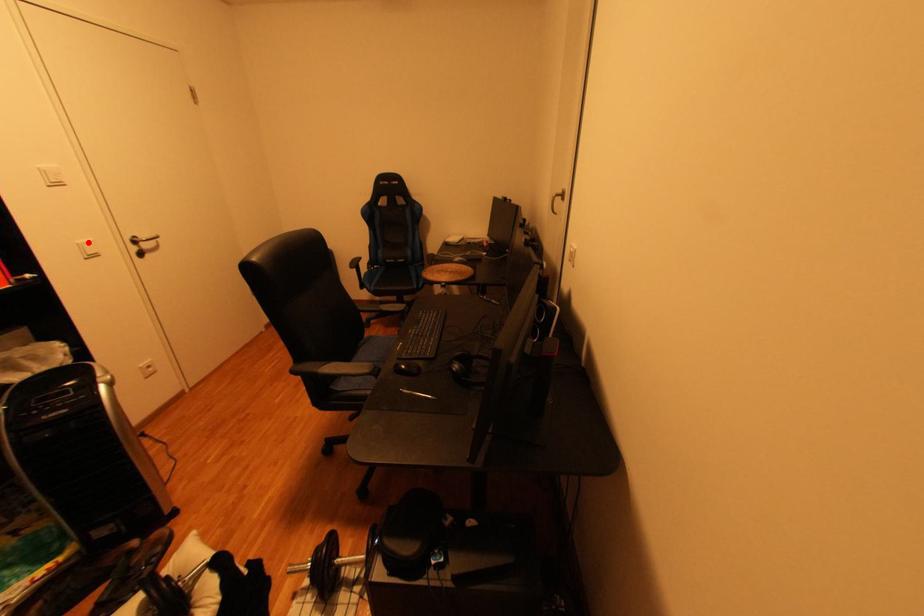
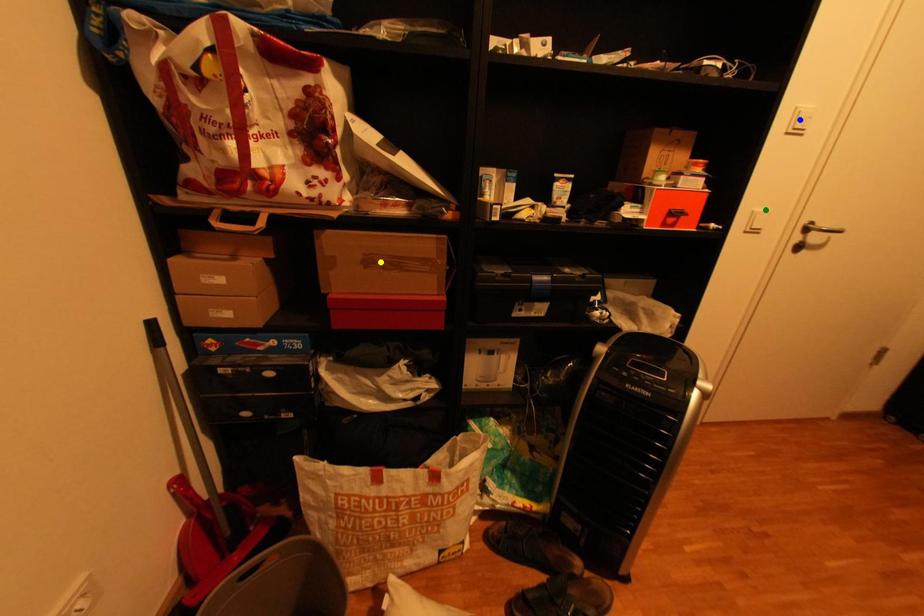
Question: I am providing you with two images of the same scene from different viewpoints. A red point is marked on the first image. You are given multiple points on the second image. In image 2, which mark is for the same physical point as the one in image 1?

Choices:
 (A) green point
 (B) blue point
 (C) yellow point

Answer: (A)